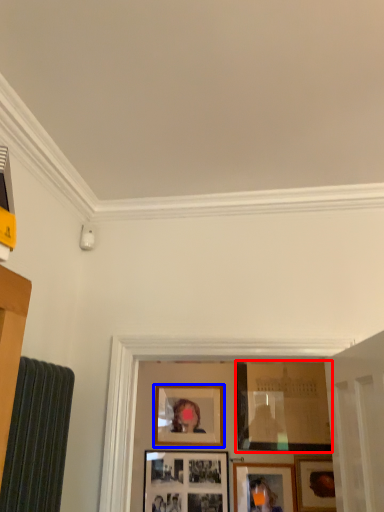
Question: Which object is further to the camera taking this photo, picture frame (highlighted by a red box) or picture frame (highlighted by a blue box)?

Choices:
 (A) picture frame
 (B) picture frame

Answer: (B)